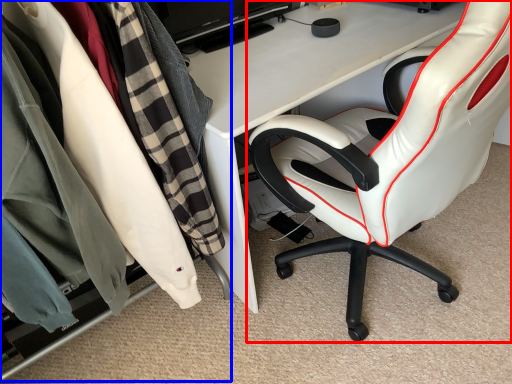
Question: Among these objects, which one is farthest to the camera, chair (highlighted by a red box) or closet (highlighted by a blue box)?

Choices:
 (A) chair
 (B) closet

Answer: (B)